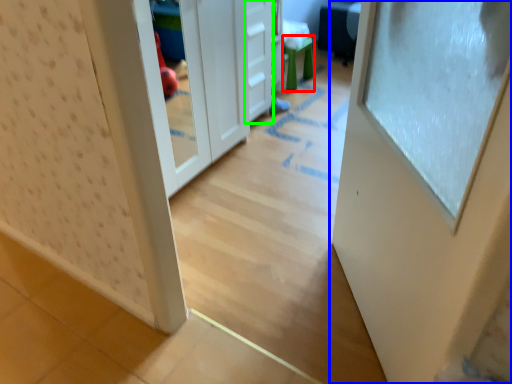
Question: Considering the real-world distances, which object is closest to stool (highlighted by a red box)? door (highlighted by a blue box) or drawer (highlighted by a green box).

Choices:
 (A) door
 (B) drawer

Answer: (B)